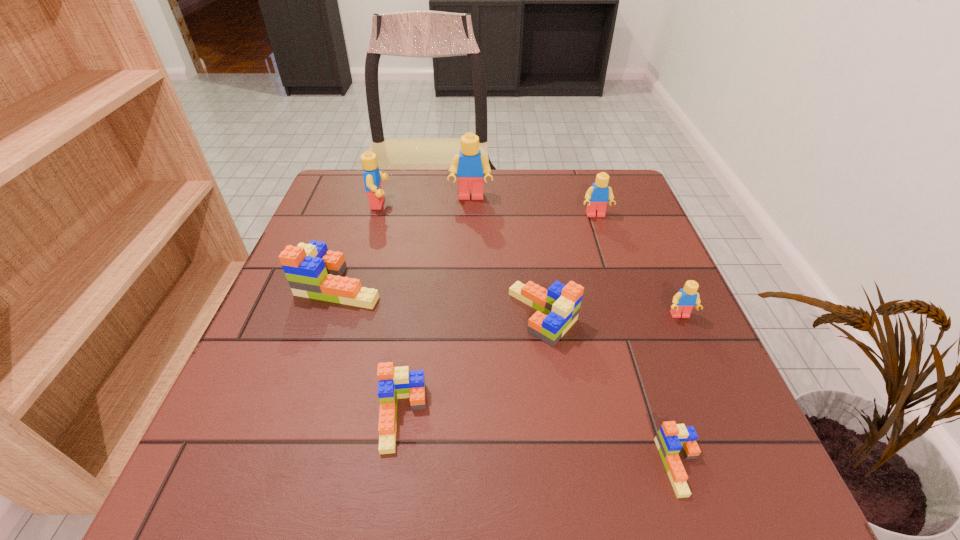
Point out which object is positioned as the nearest to the leftmost orange Lego. Please provide its 2D coordinates. Your answer should be formatted as a tuple, i.e. [(x, y)], where the tuple contains the x and y coordinates of a point satisfying the conditions above.

[(394, 383)]

You are a GUI agent. You are given a task and a screenshot of the screen. Output one action in this format:
    pyautogui.click(x=<x>, y=<y>)
    Task: Click on the object that stands as the fifth closest to the rightmost yellow Lego
    This screenshot has height=540, width=960.
    Given the screenshot: What is the action you would take?
    pyautogui.click(x=469, y=166)

Identify which Lego is the fifth nearest to the second smallest yellow Lego. Please provide its 2D coordinates. Your answer should be formatted as a tuple, i.e. [(x, y)], where the tuple contains the x and y coordinates of a point satisfying the conditions above.

[(372, 176)]

Select which Lego is the seventh closest to the seventh tallest object. Please provide its 2D coordinates. Your answer should be formatted as a tuple, i.e. [(x, y)], where the tuple contains the x and y coordinates of a point satisfying the conditions above.

[(597, 196)]

Where is `the fourth closest yellow Lego to the second biggest orange Lego`? the fourth closest yellow Lego to the second biggest orange Lego is located at coordinates (372, 176).

Where is `the second closest yellow Lego to the rightmost yellow Lego`? This screenshot has height=540, width=960. the second closest yellow Lego to the rightmost yellow Lego is located at coordinates (469, 166).

Identify which orange Lego is the closest to the rightmost Lego. Please provide its 2D coordinates. Your answer should be formatted as a tuple, i.e. [(x, y)], where the tuple contains the x and y coordinates of a point satisfying the conditions above.

[(558, 307)]

Identify which orange Lego is the closest to the shortest Lego. Please provide its 2D coordinates. Your answer should be formatted as a tuple, i.e. [(x, y)], where the tuple contains the x and y coordinates of a point satisfying the conditions above.

[(558, 307)]

This screenshot has height=540, width=960. In order to click on free region that satisfies the following two spatial constraints: 1. on the front-facing side of the shortest object; 2. on the right side of the biggest yellow Lego in this screenshot , I will do `click(463, 466)`.

The image size is (960, 540). What are the coordinates of `free spot that satisfies the following two spatial constraints: 1. on the front-facing side of the second orange Lego from right to left; 2. on the right side of the fourth Lego from left to right` in the screenshot? It's located at (468, 315).